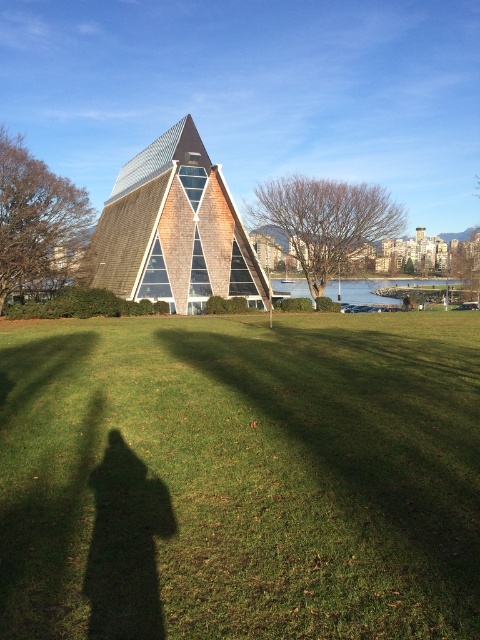
Question: Which of the following is the closest to the observer?

Choices:
 (A) green grass at center
 (B) clear blue water at lower center
 (C) wooden shingles pyramid at center

Answer: (A)

Question: Does wooden shingles pyramid at center have a greater width compared to clear blue water at lower center?

Choices:
 (A) yes
 (B) no

Answer: (B)

Question: Estimate the real-world distances between objects in this image. Which object is closer to the clear blue water at lower center?

Choices:
 (A) wooden shingles pyramid at center
 (B) green grass at center

Answer: (A)

Question: Does green grass at center lie in front of wooden shingles pyramid at center?

Choices:
 (A) no
 (B) yes

Answer: (B)

Question: Is green grass at center to the left of clear blue water at lower center from the viewer's perspective?

Choices:
 (A) no
 (B) yes

Answer: (B)

Question: Which point is closer to the camera taking this photo?

Choices:
 (A) (360, 298)
 (B) (420, 512)

Answer: (B)